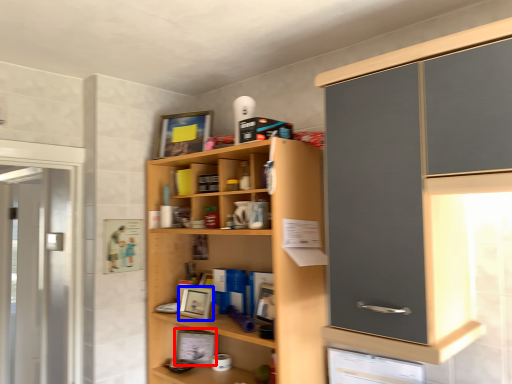
Question: Which of the following is the closest to the observer, picture frame (highlighted by a red box) or picture frame (highlighted by a blue box)?

Choices:
 (A) picture frame
 (B) picture frame

Answer: (B)